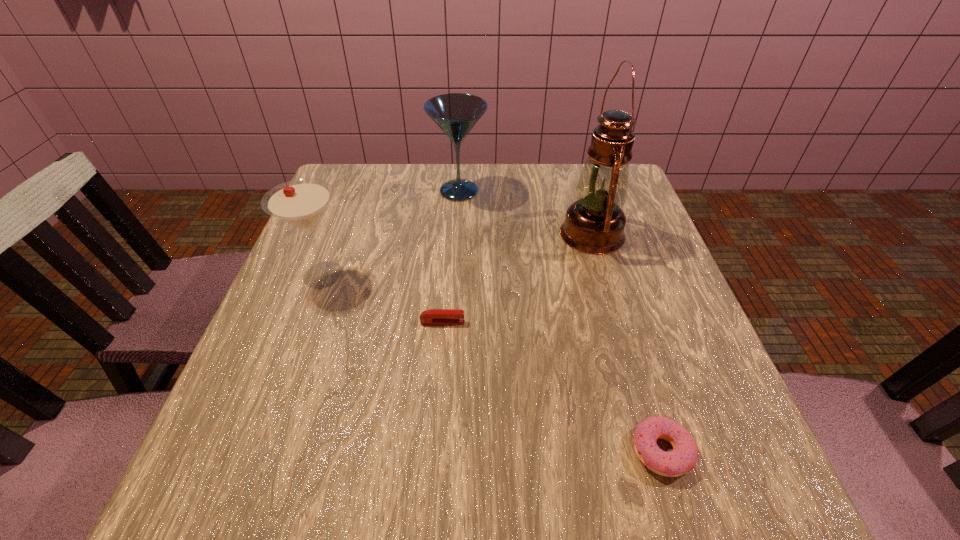
This screenshot has height=540, width=960. In order to click on free space at the far edge of the desktop in this screenshot , I will do `click(553, 201)`.

Where is `free spot at the near edge of the desktop`? This screenshot has width=960, height=540. free spot at the near edge of the desktop is located at coordinates (365, 501).

The height and width of the screenshot is (540, 960). What are the coordinates of `blank space at the right edge of the desktop` in the screenshot? It's located at (609, 257).

In the image, there is a desktop. At what (x,y) coordinates should I click in order to perform the action: click on free space at the far right corner. Please return your answer as a coordinate pair (x, y). Looking at the image, I should click on (574, 183).

Identify the location of vacant space that's between the oil lamp and the stapler. The width and height of the screenshot is (960, 540). (517, 278).

In order to click on vacant area that lies between the tallest object and the left martini in this screenshot , I will do `click(458, 254)`.

You are a GUI agent. You are given a task and a screenshot of the screen. Output one action in this format:
    pyautogui.click(x=<x>, y=<y>)
    Task: Click on the free space between the left martini and the second nearest object
    This screenshot has width=960, height=540.
    Given the screenshot: What is the action you would take?
    pyautogui.click(x=383, y=299)

The width and height of the screenshot is (960, 540). I want to click on empty space that is in between the stapler and the left martini, so (x=383, y=299).

You are a GUI agent. You are given a task and a screenshot of the screen. Output one action in this format:
    pyautogui.click(x=<x>, y=<y>)
    Task: Click on the free space between the doughnut and the tallest object
    The image size is (960, 540).
    Given the screenshot: What is the action you would take?
    pyautogui.click(x=627, y=342)

Where is `vacant space that is in between the farther martini and the nearest object`? The image size is (960, 540). vacant space that is in between the farther martini and the nearest object is located at coordinates [561, 321].